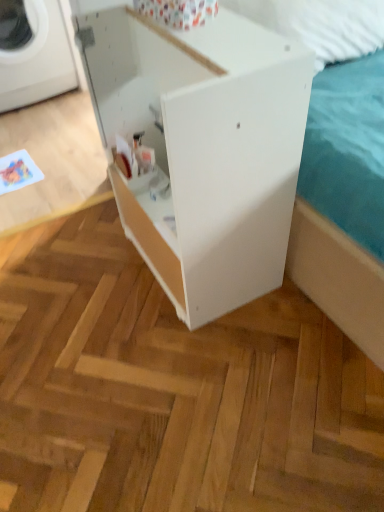
I want to click on white plastic washing machine at left, so click(x=37, y=59).

From the picture: What is the approximate height of white plastic washing machine at left?

The height of white plastic washing machine at left is 21.79 inches.

Image resolution: width=384 pixels, height=512 pixels. Describe the element at coordinates (37, 59) in the screenshot. I see `white plastic washing machine at left` at that location.

Locate an element on the screen. Image resolution: width=384 pixels, height=512 pixels. white matte cabinet at center is located at coordinates (201, 147).

The height and width of the screenshot is (512, 384). What do you see at coordinates (201, 147) in the screenshot?
I see `white matte cabinet at center` at bounding box center [201, 147].

In order to face white matte cabinet at center, should I rotate leftwards or rightwards?

To face it directly, rotate left by 0.450 degrees.

Find the location of `white plastic washing machine at left`. white plastic washing machine at left is located at coordinates (37, 59).

Which is more to the left, white plastic washing machine at left or white matte cabinet at center?

Positioned to the left is white plastic washing machine at left.

Which object is more forward, white plastic washing machine at left or white matte cabinet at center?

Positioned in front is white matte cabinet at center.

Is point (5, 63) positioned after point (223, 56)?

Yes, it is.

From the image's perspective, which object appears higher, white plastic washing machine at left or white matte cabinet at center?

white plastic washing machine at left, from the image's perspective.

From a real-world perspective, is white plastic washing machine at left under white matte cabinet at center?

Correct, in the physical world, white plastic washing machine at left is lower than white matte cabinet at center.

Can you confirm if white plastic washing machine at left is thinner than white matte cabinet at center?

Incorrect, the width of white plastic washing machine at left is not less than that of white matte cabinet at center.

Is white plastic washing machine at left taller or shorter than white matte cabinet at center?

white plastic washing machine at left is shorter than white matte cabinet at center.

Is white plastic washing machine at left smaller than white matte cabinet at center?

Correct, white plastic washing machine at left occupies less space than white matte cabinet at center.

Is white plastic washing machine at left inside the boundaries of white matte cabinet at center, or outside?

white plastic washing machine at left lies outside white matte cabinet at center.

Is there a large distance between white plastic washing machine at left and white matte cabinet at center?

Yes, white plastic washing machine at left and white matte cabinet at center are located far from each other.

Is white matte cabinet at center at the back of white plastic washing machine at left?

No.

Where is `furniture in front of the white plastic washing machine at left`? Image resolution: width=384 pixels, height=512 pixels. furniture in front of the white plastic washing machine at left is located at coordinates (201, 147).

Would you say white matte cabinet at center is to the left or to the right of white plastic washing machine at left in the picture?

white matte cabinet at center is positioned on white plastic washing machine at left's right side.

Who is more distant, white matte cabinet at center or white plastic washing machine at left?

Positioned behind is white plastic washing machine at left.

Is point (195, 226) in front of point (45, 80)?

Yes, it is.

From the image's perspective, which object appears higher, white matte cabinet at center or white plastic washing machine at left?

white plastic washing machine at left.

From a real-world perspective, is white matte cabinet at center above or below white plastic washing machine at left?

In terms of real-world spatial position, white matte cabinet at center is above white plastic washing machine at left.

Can you confirm if white matte cabinet at center is thinner than white plastic washing machine at left?

Indeed, white matte cabinet at center has a lesser width compared to white plastic washing machine at left.

Is white matte cabinet at center taller or shorter than white plastic washing machine at left?

In the image, white matte cabinet at center appears to be taller than white plastic washing machine at left.

Which of these two, white matte cabinet at center or white plastic washing machine at left, is bigger?

With larger size is white matte cabinet at center.

Do you think white matte cabinet at center is within white plastic washing machine at left, or outside of it?

white matte cabinet at center is located beyond the bounds of white plastic washing machine at left.

Is white matte cabinet at center not near white plastic washing machine at left?

Yes, white matte cabinet at center and white plastic washing machine at left are located far from each other.

Is white matte cabinet at center looking in the opposite direction of white plastic washing machine at left?

No, white plastic washing machine at left is not at the back of white matte cabinet at center.

How far apart are white matte cabinet at center and white plastic washing machine at left?

They are 1.50 meters apart.

Locate an element on the screen. Image resolution: width=384 pixels, height=512 pixels. washing machine on the left side of white matte cabinet at center is located at coordinates (37, 59).

In order to click on furniture that appears on the right of white plastic washing machine at left in this screenshot , I will do `click(201, 147)`.

You are a GUI agent. You are given a task and a screenshot of the screen. Output one action in this format:
    pyautogui.click(x=<x>, y=<y>)
    Task: Click on the furniture above the white plastic washing machine at left (from a real-world perspective)
    
    Given the screenshot: What is the action you would take?
    tap(201, 147)